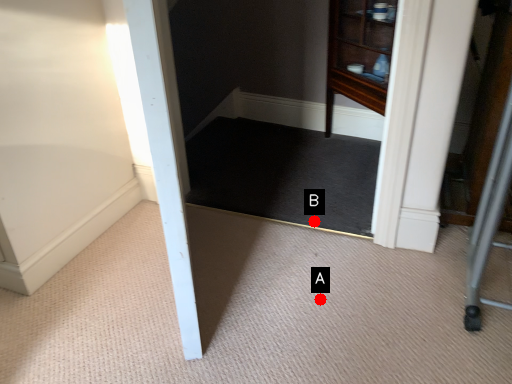
Question: Two points are circled on the image, labeled by A and B beside each circle. Which point appears closest to the camera in this image?

Choices:
 (A) A is closer
 (B) B is closer

Answer: (A)